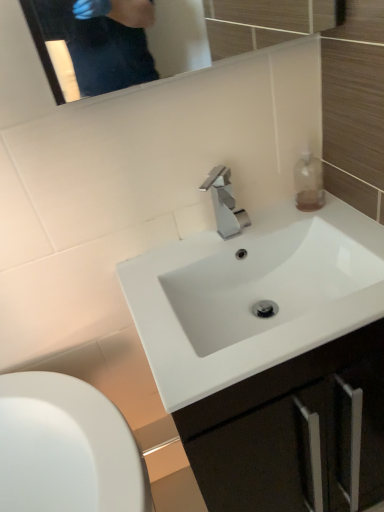
Find the location of a particular element. This screenshot has width=384, height=512. free point to the right of polished metallic faucet at center is located at coordinates (286, 223).